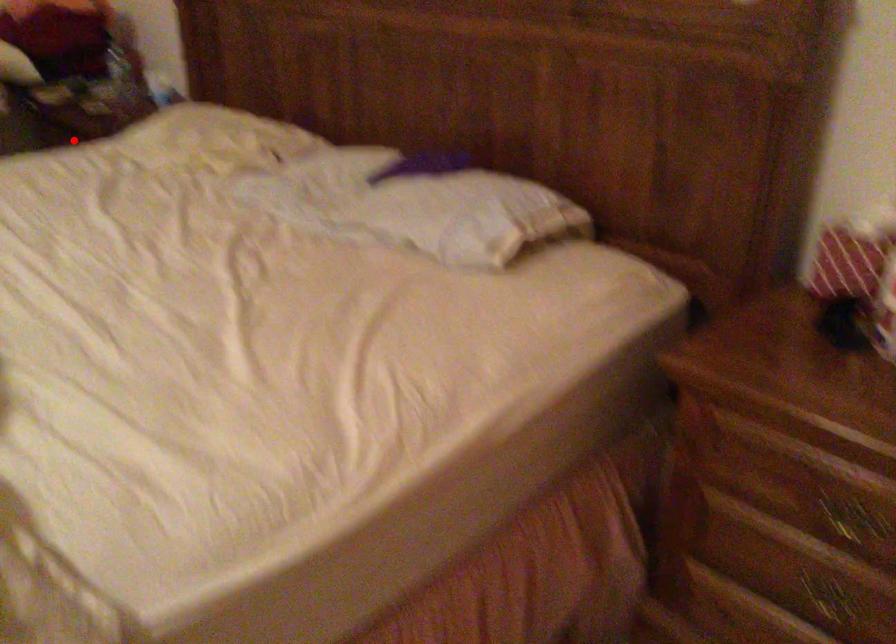
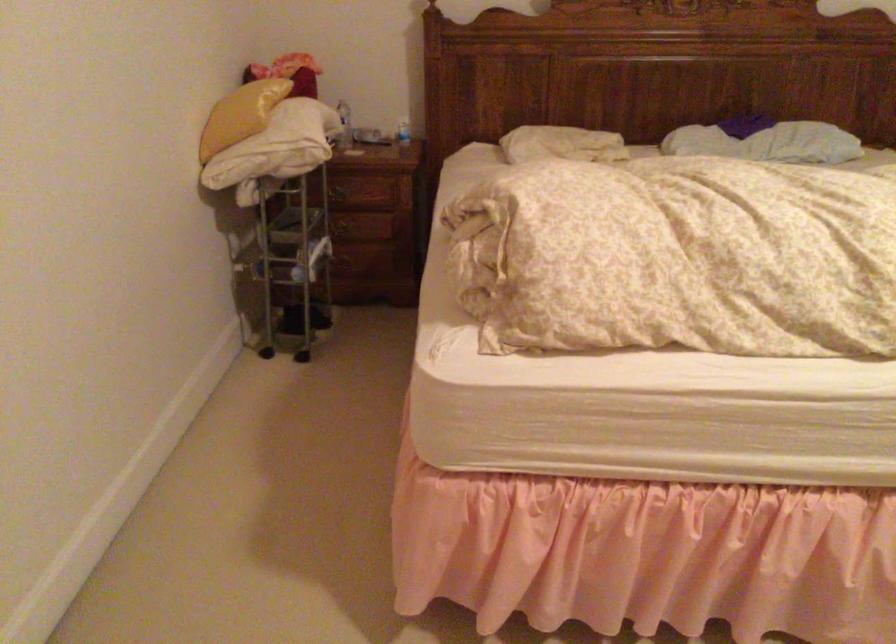
Question: I am providing you with two images of the same scene from different viewpoints. In image1, a red point is highlighted. Considering the same 3D point in image2, which of the following is correct?

Choices:
 (A) It is closer
 (B) It is farther

Answer: (B)